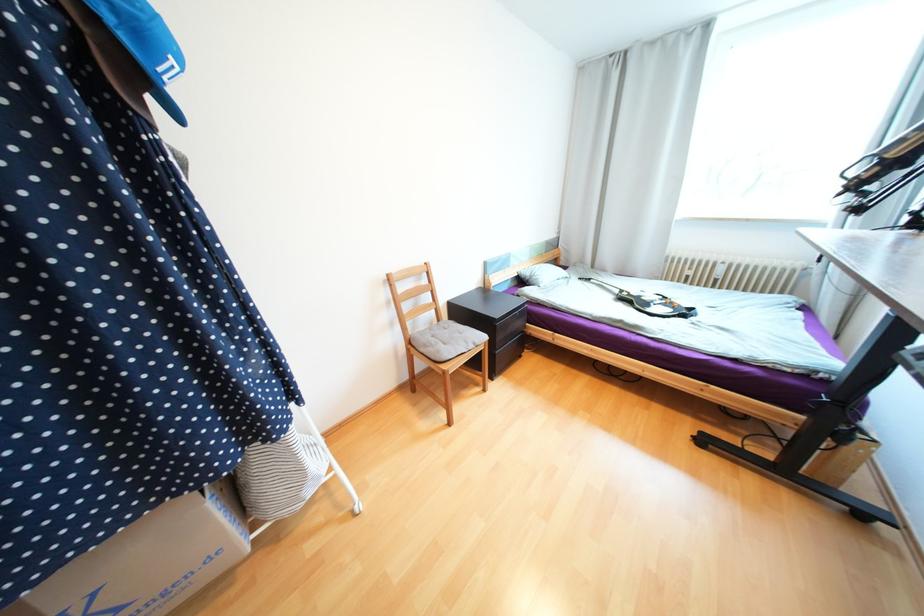
Locate an element on the screen. gray pillow is located at coordinates (541, 274).